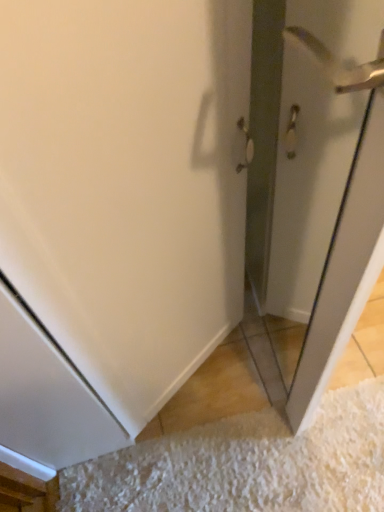
Where is `free spot above white textured doormat at lower right (from a real-world perspective)`? free spot above white textured doormat at lower right (from a real-world perspective) is located at coordinates (259, 457).